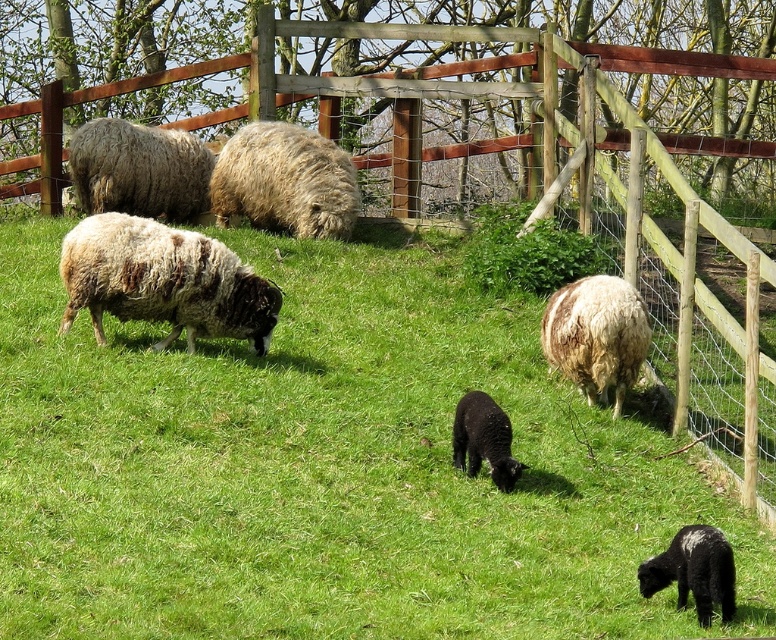
You are standing at the center of the fenced area in the image. Looking towards the upper center, you notice a specific point marked at coordinates (286, 180). What object is located at this point?

At point (286, 180) lies fluffy white wool at upper center.

You are a farmer checking the sheep in the image. You need to identify which of the two sheep, the fluffy white wool at upper center or the fluffy woolen sheep at upper left, has a wider body. Based on the scene description, which one is wider?

The fluffy white wool at upper center has a larger width than the fluffy woolen sheep at upper left, so the fluffy white wool at upper center is wider.